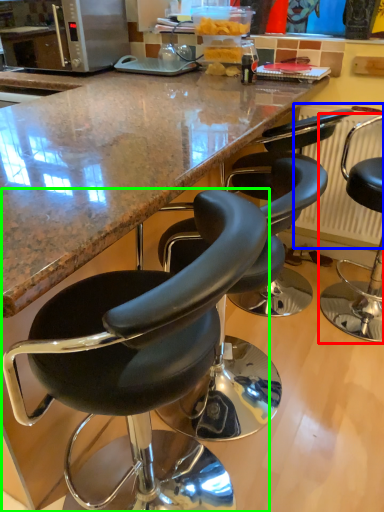
Question: Estimate the real-world distances between objects in this image. Which object is farther from chair (highlighted by a red box), radiator (highlighted by a blue box) or chair (highlighted by a green box)?

Choices:
 (A) radiator
 (B) chair

Answer: (B)